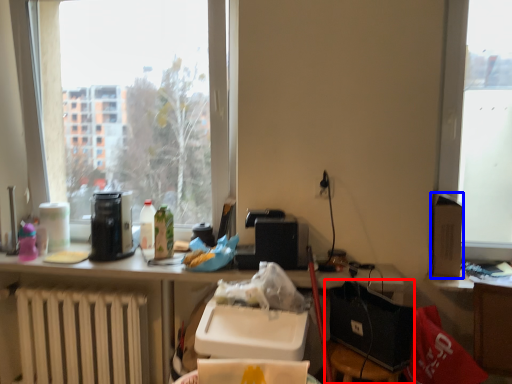
Question: Which point is further to the camera, chair (highlighted by a red box) or box (highlighted by a blue box)?

Choices:
 (A) chair
 (B) box

Answer: (B)